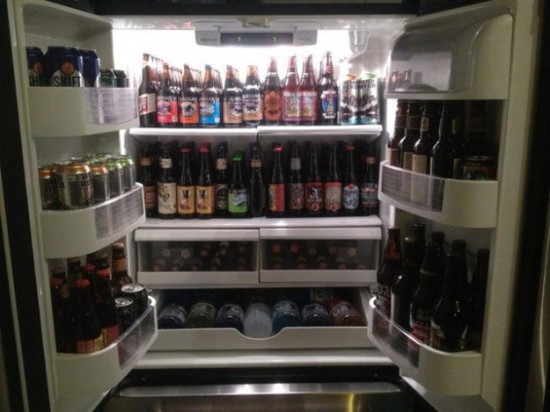
In order to click on fridge door in this screenshot , I will do `click(22, 337)`.